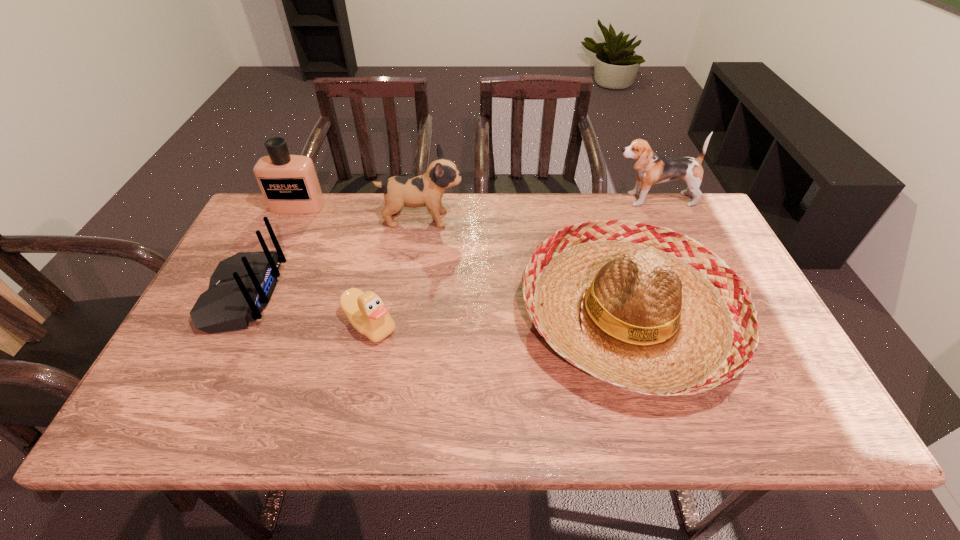
Locate an element on the screen. The width and height of the screenshot is (960, 540). vacant space that satisfies the following two spatial constraints: 1. at the face of the farther puppy; 2. on the front label of the perfume is located at coordinates (655, 206).